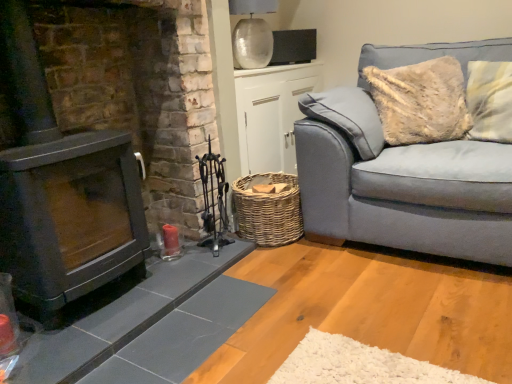
Describe the element at coordinates (404, 170) in the screenshot. The width and height of the screenshot is (512, 384). I see `light blue fabric couch at right` at that location.

Measure the distance between point (426, 46) and camera.

2.58 meters.

What are the coordinates of `woven brown basket at lower center` in the screenshot? It's located at (268, 211).

Image resolution: width=512 pixels, height=384 pixels. I want to click on matte black fireplace at left, so click(x=98, y=135).

Looking at this image, is light blue fabric couch at right not close to woven wicker basket at center?

No.

Is light blue fabric couch at right taller than woven wicker basket at center?

Yes, light blue fabric couch at right is taller than woven wicker basket at center.

From the image's perspective, which object appears higher, light blue fabric couch at right or woven wicker basket at center?

woven wicker basket at center, from the image's perspective.

From a real-world perspective, who is located lower, light blue fabric couch at right or woven wicker basket at center?

woven wicker basket at center is physically lower.

From the picture: Is woven brown basket at lower center not near matte black fireplace at left?

woven brown basket at lower center is near matte black fireplace at left, not far away.

Considering the points (254, 204) and (173, 306), which point is in front, point (254, 204) or point (173, 306)?

Point (173, 306)

Considering the positions of objects woven brown basket at lower center and matte black fireplace at left in the image provided, who is behind, woven brown basket at lower center or matte black fireplace at left?

woven brown basket at lower center.

Is matte black fireplace at left far from woven brown basket at lower center?

Actually, matte black fireplace at left and woven brown basket at lower center are a little close together.

From the image's perspective, which is above, matte black fireplace at left or woven brown basket at lower center?

matte black fireplace at left.

Is matte black fireplace at left shorter than woven brown basket at lower center?

In fact, matte black fireplace at left may be taller than woven brown basket at lower center.

How different are the orientations of matte black fireplace at left and woven brown basket at lower center in degrees?

The angle between the facing direction of matte black fireplace at left and the facing direction of woven brown basket at lower center is 87.3 degrees.

Between light blue fabric couch at right and matte black fireplace at left, which one appears on the left side from the viewer's perspective?

matte black fireplace at left is more to the left.

Is light blue fabric couch at right facing towards matte black fireplace at left?

No, light blue fabric couch at right is not aimed at matte black fireplace at left.

From a real-world perspective, which is physically below, light blue fabric couch at right or matte black fireplace at left?

In real-world perspective, light blue fabric couch at right is lower.

Does matte black fireplace at left have a lesser width compared to woven wicker basket at center?

No.

In the image, there is a matte black fireplace at left. Where is `table above it (from the image's perspective)`? table above it (from the image's perspective) is located at coordinates (271, 114).

Considering the sizes of objects matte black fireplace at left and woven wicker basket at center in the image provided, who is bigger, matte black fireplace at left or woven wicker basket at center?

With larger size is matte black fireplace at left.

From the image's perspective, which is below, woven brown basket at lower center or light blue fabric couch at right?

From the image's view, woven brown basket at lower center is below.

Measure the distance between woven brown basket at lower center and light blue fabric couch at right.

A distance of 14.52 inches exists between woven brown basket at lower center and light blue fabric couch at right.

Would you say woven brown basket at lower center is outside light blue fabric couch at right?

woven brown basket at lower center is positioned outside light blue fabric couch at right.

Locate an element on the screen. The image size is (512, 384). basket below the light blue fabric couch at right (from a real-world perspective) is located at coordinates (268, 211).

Is woven wicker basket at center in front of or behind light blue fabric couch at right in the image?

Visually, woven wicker basket at center is located behind light blue fabric couch at right.

Are woven wicker basket at center and light blue fabric couch at right located far from each other?

That's not correct — woven wicker basket at center is a little close to light blue fabric couch at right.

In order to click on studio couch that is on the right side of woven wicker basket at center in this screenshot , I will do `click(404, 170)`.

From a real-world perspective, which is physically below, woven wicker basket at center or light blue fabric couch at right?

woven wicker basket at center is physically lower.

Locate an element on the screen. table above the light blue fabric couch at right (from the image's perspective) is located at coordinates (271, 114).

At what (x,y) coordinates should I click in order to perform the action: click on basket below the matte black fireplace at left (from a real-world perspective). Please return your answer as a coordinate pair (x, y). This screenshot has height=384, width=512. Looking at the image, I should click on coord(268,211).

Based on their spatial positions, is light blue fabric couch at right or woven wicker basket at center further from matte black fireplace at left?

Among the two, light blue fabric couch at right is located further to matte black fireplace at left.

Considering their positions, is woven wicker basket at center positioned further to matte black fireplace at left than light blue fabric couch at right?

Among the two, light blue fabric couch at right is located further to matte black fireplace at left.

Looking at the image, which one is located further to light blue fabric couch at right, matte black fireplace at left or woven brown basket at lower center?

Based on the image, matte black fireplace at left appears to be further to light blue fabric couch at right.

When comparing their distances from woven brown basket at lower center, does woven wicker basket at center or light blue fabric couch at right seem closer?

light blue fabric couch at right.

From the image, which object appears to be farther from woven wicker basket at center, light blue fabric couch at right or matte black fireplace at left?

Based on the image, light blue fabric couch at right appears to be further to woven wicker basket at center.

Looking at the image, which one is located further to woven wicker basket at center, woven brown basket at lower center or matte black fireplace at left?

matte black fireplace at left is further to woven wicker basket at center.

Consider the image. Which object lies further to the anchor point woven brown basket at lower center, light blue fabric couch at right or woven wicker basket at center?

woven wicker basket at center is further to woven brown basket at lower center.

Which object lies further to the anchor point woven wicker basket at center, light blue fabric couch at right or woven brown basket at lower center?

Based on the image, light blue fabric couch at right appears to be further to woven wicker basket at center.

Identify the location of table situated between matte black fireplace at left and light blue fabric couch at right from left to right. The width and height of the screenshot is (512, 384). (271, 114).

You are a GUI agent. You are given a task and a screenshot of the screen. Output one action in this format:
    pyautogui.click(x=<x>, y=<y>)
    Task: Click on the basket between woven wicker basket at center and light blue fabric couch at right in the horizontal direction
    The image size is (512, 384).
    Given the screenshot: What is the action you would take?
    pyautogui.click(x=268, y=211)

Where is `basket between matte black fireplace at left and woven wicker basket at center in the front-back direction`? The width and height of the screenshot is (512, 384). basket between matte black fireplace at left and woven wicker basket at center in the front-back direction is located at coordinates (268, 211).

At what (x,y) coordinates should I click in order to perform the action: click on basket located between matte black fireplace at left and light blue fabric couch at right in the left-right direction. Please return your answer as a coordinate pair (x, y). The height and width of the screenshot is (384, 512). Looking at the image, I should click on (268, 211).